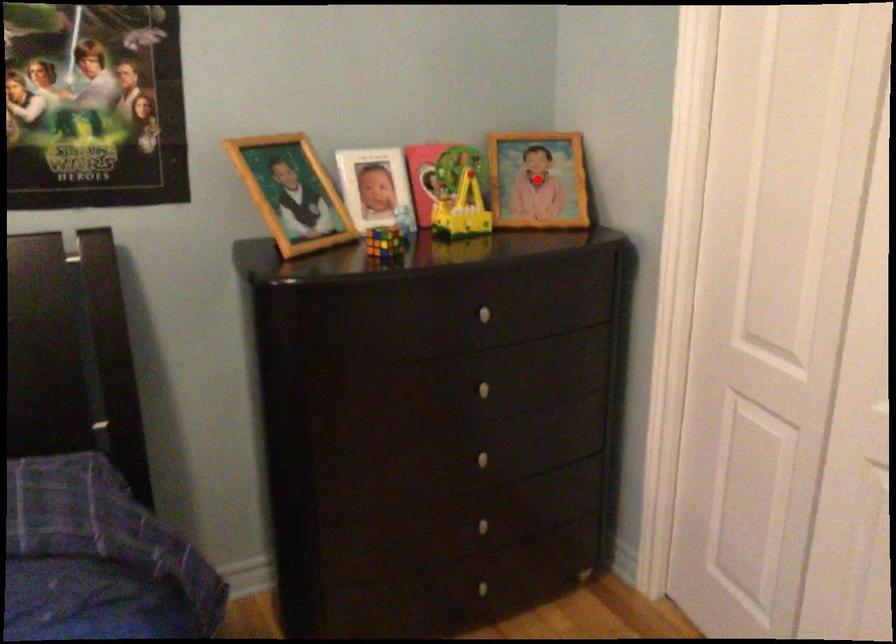
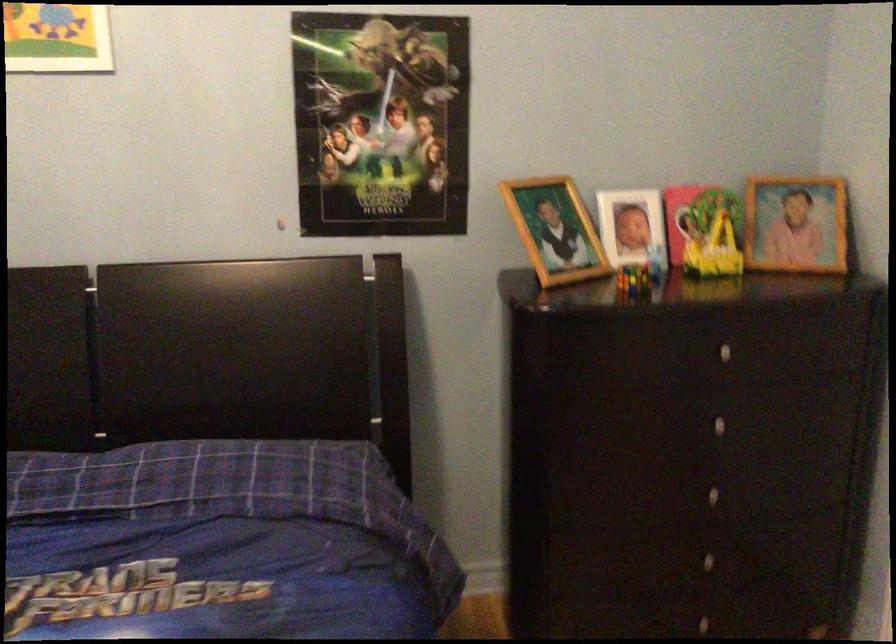
Locate, in the second image, the point that corresponds to the highlighted location in the first image.

(796, 223)